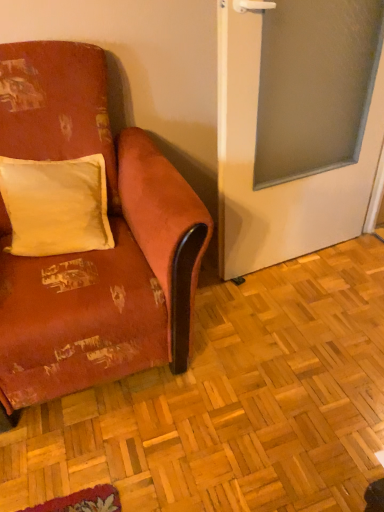
Where is `velvet-like orange couch at left`? The height and width of the screenshot is (512, 384). velvet-like orange couch at left is located at coordinates (92, 251).

Measure the distance between velvet-like orange couch at left and camera.

The distance of velvet-like orange couch at left from camera is 1.21 meters.

You are a GUI agent. You are given a task and a screenshot of the screen. Output one action in this format:
    pyautogui.click(x=<x>, y=<y>)
    Task: Click on the velvet-like orange couch at left
    This screenshot has height=512, width=384.
    Given the screenshot: What is the action you would take?
    pyautogui.click(x=92, y=251)

Is white soft cushion at upper left positioned beyond the bounds of velvet-like orange couch at left?

No, most part of white soft cushion at upper left lies within velvet-like orange couch at left.

Could you tell me if white soft cushion at upper left is turned towards velvet-like orange couch at left?

Yes, white soft cushion at upper left faces towards velvet-like orange couch at left.

Is white soft cushion at upper left wider or thinner than velvet-like orange couch at left?

white soft cushion at upper left is thinner than velvet-like orange couch at left.

Considering the sizes of objects white soft cushion at upper left and velvet-like orange couch at left in the image provided, who is taller, white soft cushion at upper left or velvet-like orange couch at left?

Standing taller between the two is velvet-like orange couch at left.

Considering the sizes of objects white soft cushion at upper left and frosted glass screen door at right in the image provided, who is shorter, white soft cushion at upper left or frosted glass screen door at right?

white soft cushion at upper left is shorter.

Between white soft cushion at upper left and frosted glass screen door at right, which one has smaller size?

white soft cushion at upper left is smaller.

From the image's perspective, is white soft cushion at upper left below frosted glass screen door at right?

Yes, from the image's perspective, white soft cushion at upper left is beneath frosted glass screen door at right.

How many degrees apart are the facing directions of frosted glass screen door at right and white soft cushion at upper left?

The angle between the facing direction of frosted glass screen door at right and the facing direction of white soft cushion at upper left is 14 degrees.

Looking at this image, is frosted glass screen door at right oriented towards white soft cushion at upper left?

No, frosted glass screen door at right is not turned towards white soft cushion at upper left.

From a real-world perspective, is frosted glass screen door at right positioned under white soft cushion at upper left based on gravity?

No, from a real-world perspective, frosted glass screen door at right is not below white soft cushion at upper left.

Which object is positioned more to the left, frosted glass screen door at right or velvet-like orange couch at left?

From the viewer's perspective, velvet-like orange couch at left appears more on the left side.

Looking at this image, how many degrees apart are the facing directions of frosted glass screen door at right and velvet-like orange couch at left?

There is a 4.28-degree angle between the facing directions of frosted glass screen door at right and velvet-like orange couch at left.

Consider the image. Could you tell me if frosted glass screen door at right is facing velvet-like orange couch at left?

No.

From the image's perspective, which is below, velvet-like orange couch at left or frosted glass screen door at right?

velvet-like orange couch at left.

From a real-world perspective, is velvet-like orange couch at left over frosted glass screen door at right?

Incorrect, from a real-world perspective, velvet-like orange couch at left is lower than frosted glass screen door at right.

Between velvet-like orange couch at left and frosted glass screen door at right, which one has less height?

velvet-like orange couch at left is shorter.

How different are the orientations of velvet-like orange couch at left and frosted glass screen door at right in degrees?

The angular difference between velvet-like orange couch at left and frosted glass screen door at right is 4.28 degrees.

Can we say velvet-like orange couch at left lies outside white soft cushion at upper left?

velvet-like orange couch at left is positioned outside white soft cushion at upper left.

Which of these two, velvet-like orange couch at left or white soft cushion at upper left, is smaller?

white soft cushion at upper left.

Does velvet-like orange couch at left turn towards white soft cushion at upper left?

Yes.

From the image's perspective, who appears lower, velvet-like orange couch at left or white soft cushion at upper left?

velvet-like orange couch at left is shown below in the image.

Identify the location of studio couch in front of the white soft cushion at upper left. (92, 251).

In order to click on screen door that is above the white soft cushion at upper left (from the image's perspective) in this screenshot , I will do [x=284, y=183].

From the image, which object appears to be farther from frosted glass screen door at right, white soft cushion at upper left or velvet-like orange couch at left?

white soft cushion at upper left lies further to frosted glass screen door at right than the other object.

Based on their spatial positions, is velvet-like orange couch at left or white soft cushion at upper left closer to frosted glass screen door at right?

velvet-like orange couch at left is positioned closer to the anchor frosted glass screen door at right.

Looking at the image, which one is located closer to white soft cushion at upper left, velvet-like orange couch at left or frosted glass screen door at right?

velvet-like orange couch at left lies closer to white soft cushion at upper left than the other object.

Which object lies further to the anchor point white soft cushion at upper left, frosted glass screen door at right or velvet-like orange couch at left?

Based on the image, frosted glass screen door at right appears to be further to white soft cushion at upper left.

Which object lies nearer to the anchor point velvet-like orange couch at left, white soft cushion at upper left or frosted glass screen door at right?

white soft cushion at upper left lies closer to velvet-like orange couch at left than the other object.

From the image, which object appears to be farther from velvet-like orange couch at left, frosted glass screen door at right or white soft cushion at upper left?

Based on the image, frosted glass screen door at right appears to be further to velvet-like orange couch at left.

Identify the location of studio couch located between white soft cushion at upper left and frosted glass screen door at right in the left-right direction. (92, 251).